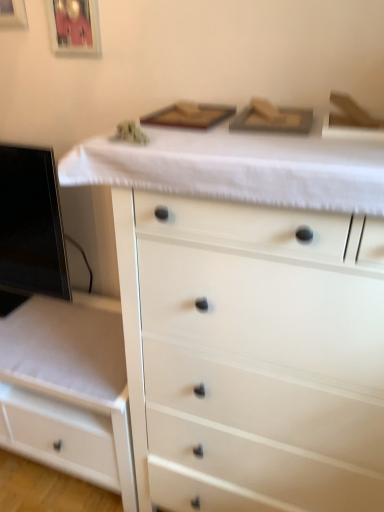
This screenshot has width=384, height=512. Identify the location of blank space situated above white glossy drawer at lower left, which is the 2th chest of drawers in right-to-left order (from a real-world perspective). 57,329.